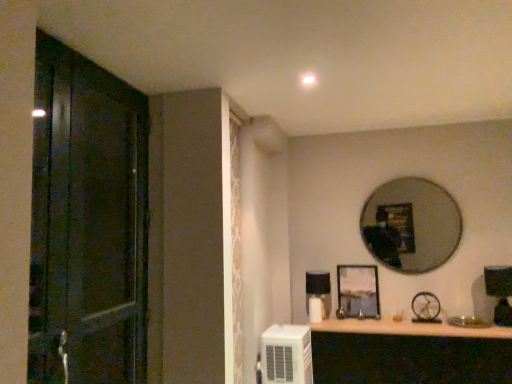
Locate an element on the screen. free space in front of metallic silver picture frame at center is located at coordinates (362, 324).